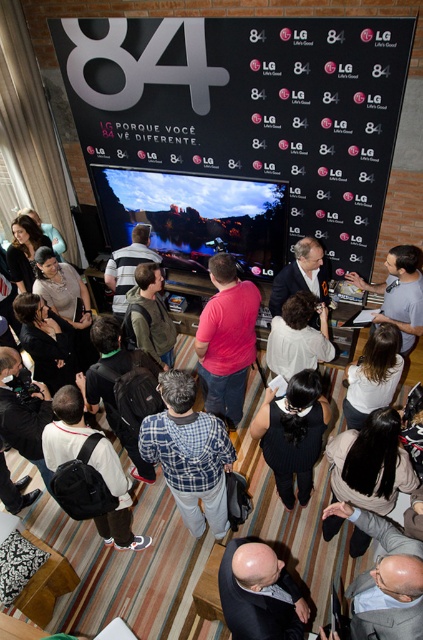
Question: Which point is farther to the camera?

Choices:
 (A) striped shirt at center
 (B) gray casual shirt at center

Answer: (A)

Question: Among these points, which one is nearest to the camera?

Choices:
 (A) [151, 420]
 (B) [68, 412]

Answer: (A)

Question: Does blue checkered shirt at center lie behind black textured dress at center?

Choices:
 (A) yes
 (B) no

Answer: (B)

Question: Which of these objects is positioned closest to the dark suit at center?

Choices:
 (A) blue checkered shirt at center
 (B) pink fabric shirt at center
 (C) striped shirt at center

Answer: (A)

Question: Where is blue checkered shirt at center located in relation to black textured dress at center in the image?

Choices:
 (A) above
 (B) below

Answer: (B)

Question: Does black textured dress at center have a lesser width compared to gray casual shirt at center?

Choices:
 (A) yes
 (B) no

Answer: (B)